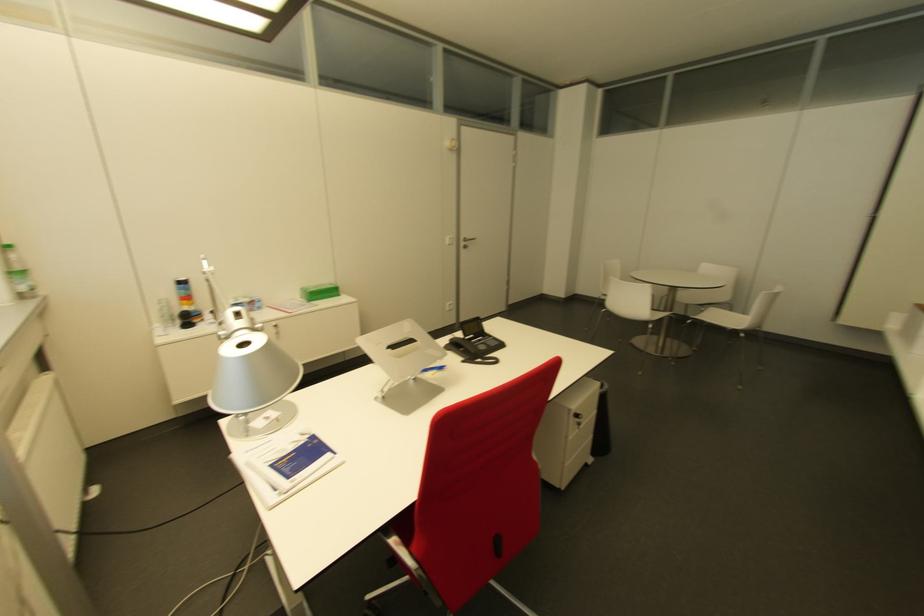
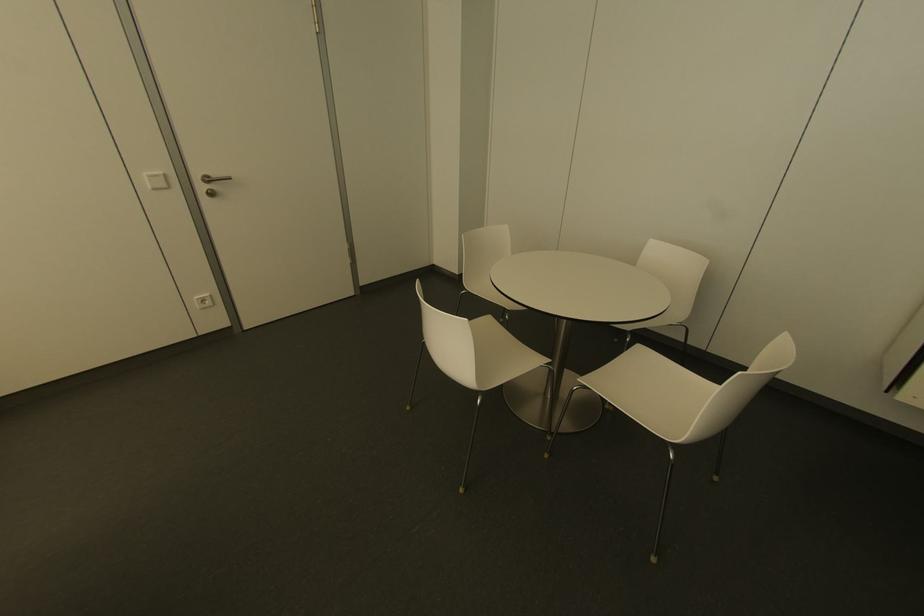
Locate, in the second image, the point that corresponds to (x=448, y=237) in the first image.

(159, 172)